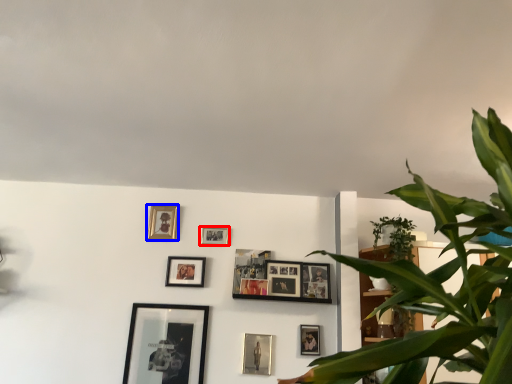
Question: Which object is closer to the camera taking this photo, picture frame (highlighted by a red box) or picture frame (highlighted by a blue box)?

Choices:
 (A) picture frame
 (B) picture frame

Answer: (A)